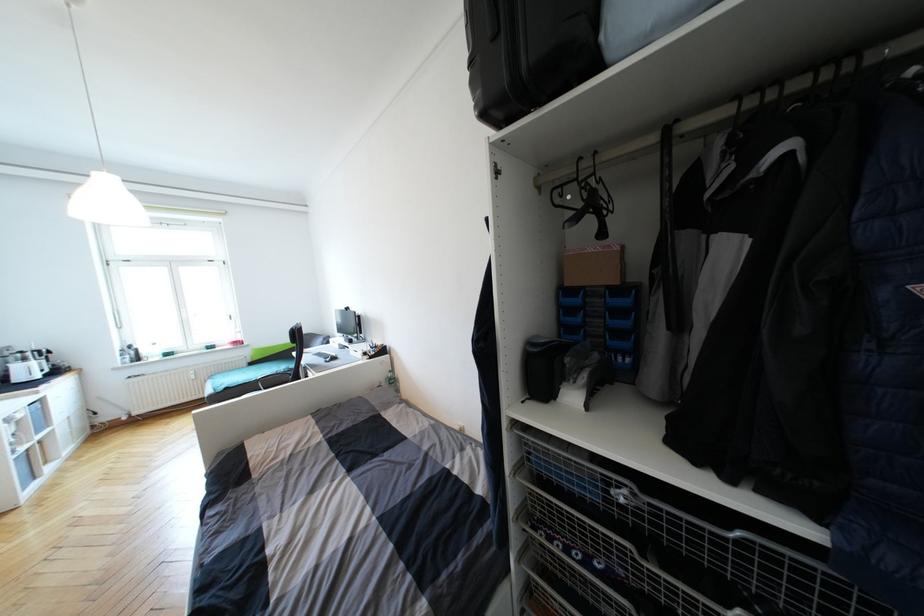
Describe the element at coordinates (391, 379) in the screenshot. I see `a green plastic bottle` at that location.